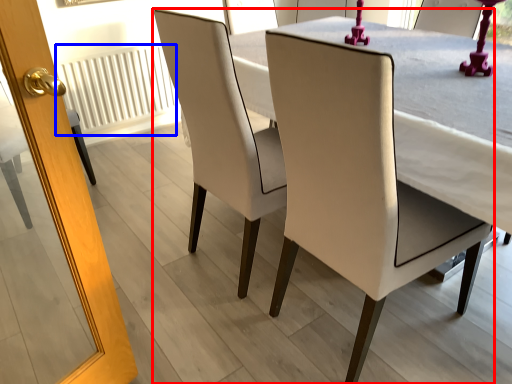
Question: Which point is further to the camera, chair (highlighted by a red box) or radiator (highlighted by a blue box)?

Choices:
 (A) chair
 (B) radiator

Answer: (B)